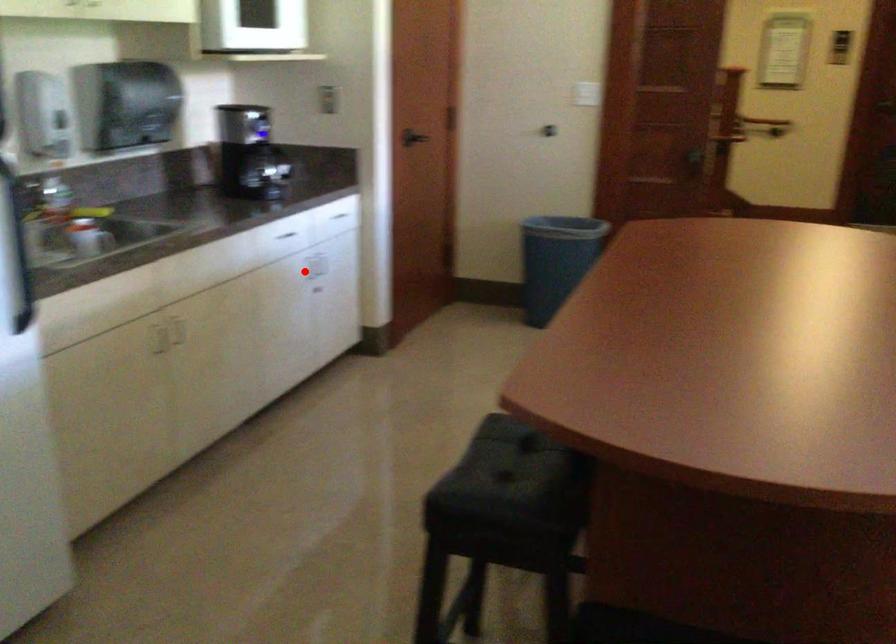
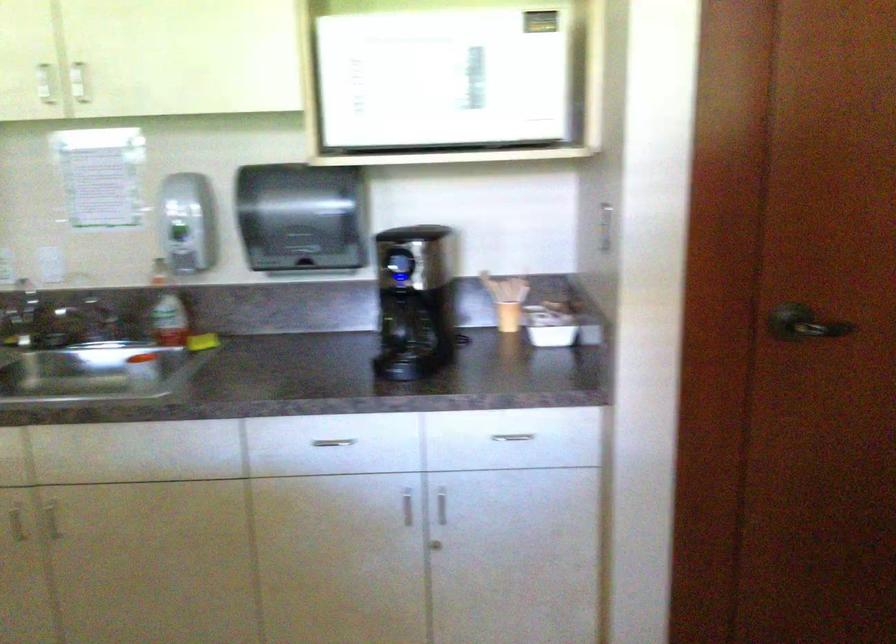
Question: I am providing you with two images of the same scene from different viewpoints. Image1 has a red point marked. In image2, the corresponding 3D location appears at what relative position? Reply with the corresponding letter.

Choices:
 (A) Closer
 (B) Farther

Answer: (A)